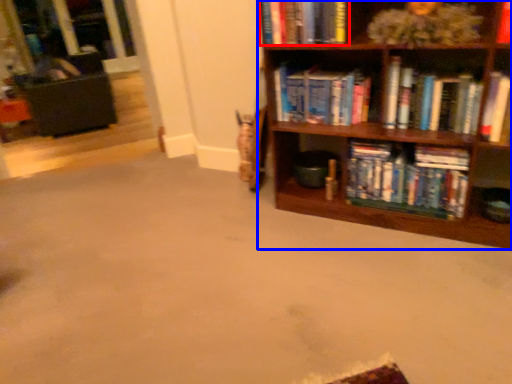
Question: Which point is further to the camera, book (highlighted by a red box) or bookcase (highlighted by a blue box)?

Choices:
 (A) book
 (B) bookcase

Answer: (A)